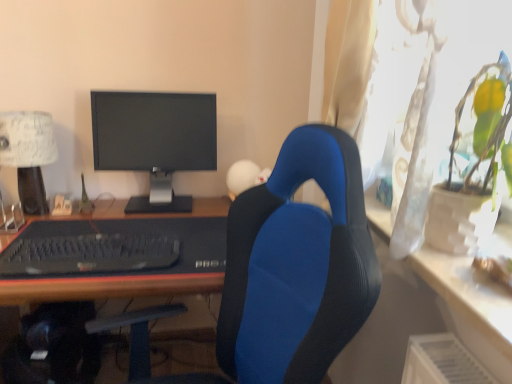
At what (x,y) coordinates should I click in order to perform the action: click on vacant region below matte black monitor at center (from a real-world perspective). Please return your answer as a coordinate pair (x, y). The image size is (512, 384). Looking at the image, I should click on (152, 202).